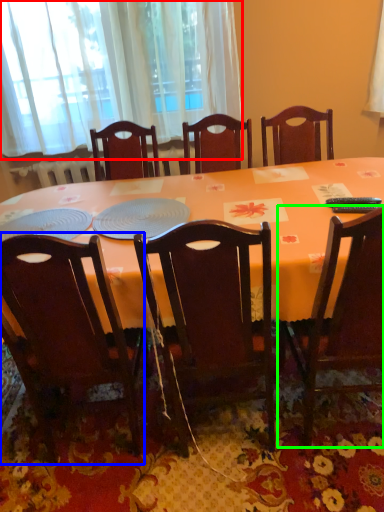
Question: Estimate the real-world distances between objects in this image. Which object is farther from window screen (highlighted by a red box), chair (highlighted by a blue box) or chair (highlighted by a green box)?

Choices:
 (A) chair
 (B) chair

Answer: (B)